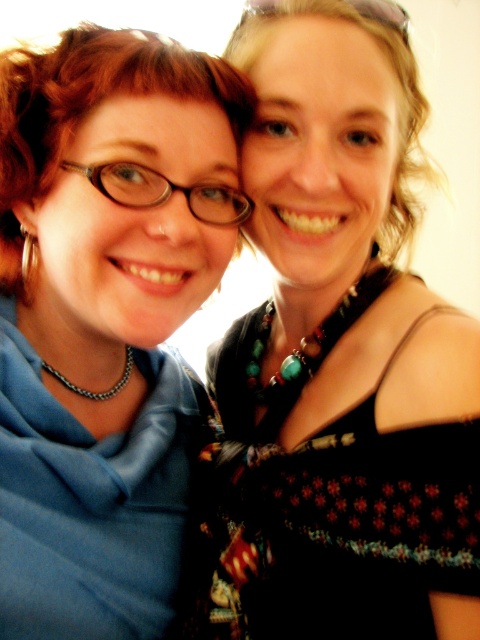
Question: Can you confirm if matte blue scarf at left is positioned to the left of black textured dress at upper right?

Choices:
 (A) no
 (B) yes

Answer: (B)

Question: Does matte blue scarf at left appear under black textured dress at upper right?

Choices:
 (A) yes
 (B) no

Answer: (B)

Question: Can you confirm if matte blue scarf at left is positioned below black textured dress at upper right?

Choices:
 (A) no
 (B) yes

Answer: (A)

Question: Which point appears closest to the camera in this image?

Choices:
 (A) (467, 579)
 (B) (179, 561)

Answer: (A)